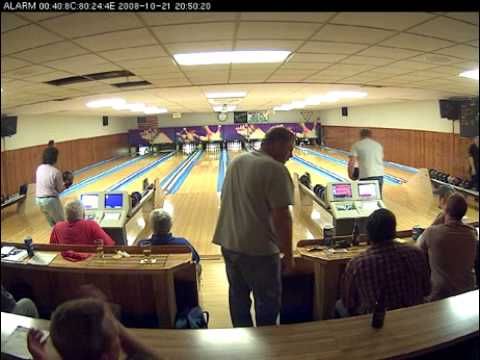
Find the location of a particular element. The width and height of the screenshot is (480, 360). monitors is located at coordinates (365, 190), (345, 193), (116, 201), (92, 199).